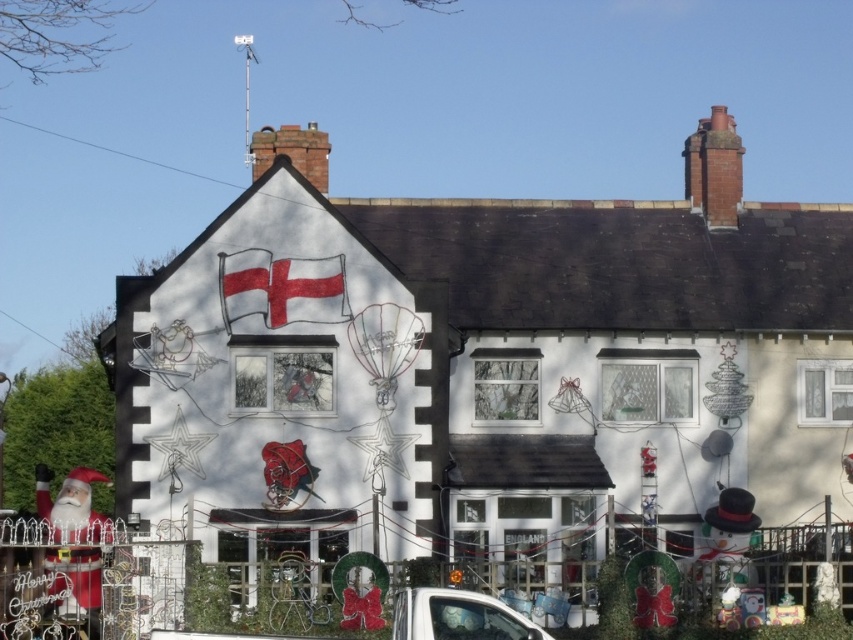
Question: Does red matte flag at upper left appear on the left side of white glossy car at lower center?

Choices:
 (A) yes
 (B) no

Answer: (A)

Question: Does red fabric santa claus at lower left come in front of white glossy car at lower center?

Choices:
 (A) no
 (B) yes

Answer: (A)

Question: Which point is farther to the camera?

Choices:
 (A) (88, 508)
 (B) (263, 284)

Answer: (A)

Question: Which point is closer to the camera?

Choices:
 (A) (55, 531)
 (B) (408, 609)

Answer: (B)

Question: Which is nearer to the white glossy car at lower center?

Choices:
 (A) red fabric santa claus at lower left
 (B) red matte flag at upper left

Answer: (B)

Question: Does red fabric santa claus at lower left appear on the left side of white glossy car at lower center?

Choices:
 (A) no
 (B) yes

Answer: (B)